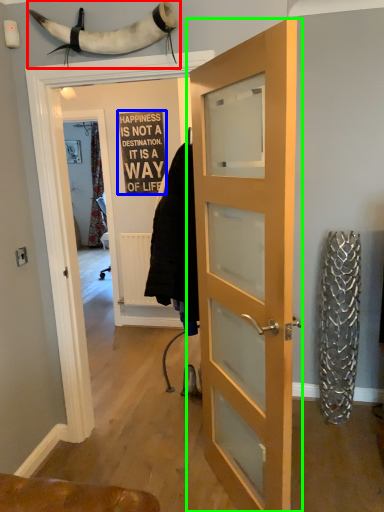
Question: Which object is positioned farthest from animal (highlighted by a red box)? Select from writing (highlighted by a blue box) and door (highlighted by a green box).

Choices:
 (A) writing
 (B) door

Answer: (A)